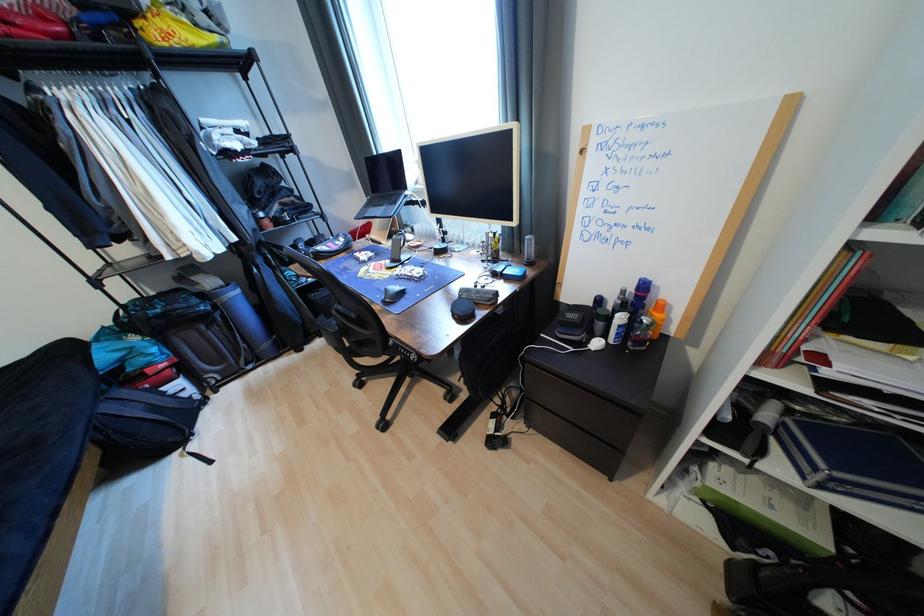
Locate an element on the screen. laptop computer is located at coordinates (383, 185).